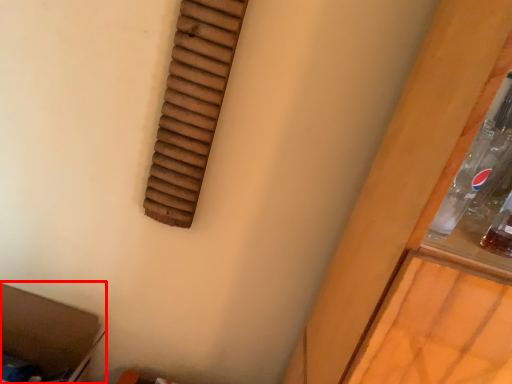
Question: From the image's perspective, what is the correct spatial positioning of storage box (annotated by the red box) in reference to window?

Choices:
 (A) below
 (B) above

Answer: (A)